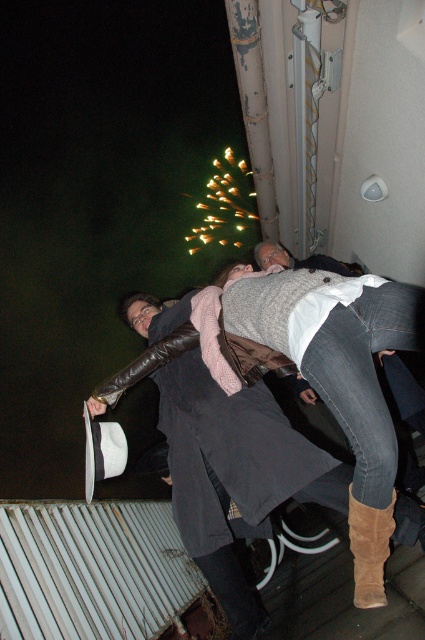
Looking at this image, who is positioned more to the left, matte black coat at center or suede boot at lower right?

matte black coat at center is more to the left.

Is point (280, 412) closer to camera compared to point (365, 577)?

No, (280, 412) is further to viewer.

Locate an element on the screen. matte black coat at center is located at coordinates [223, 452].